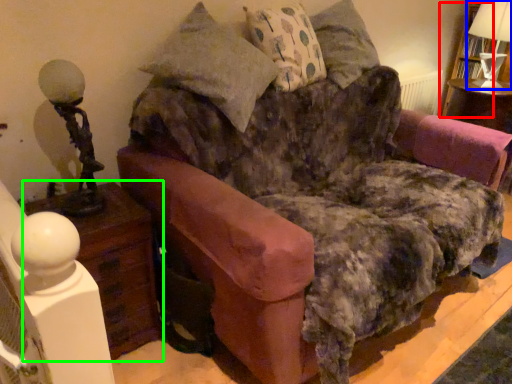
Question: Estimate the real-world distances between objects in this image. Which object is closer to bookshelf (highlighted by a red box), table lamp (highlighted by a blue box) or nightstand (highlighted by a green box)?

Choices:
 (A) table lamp
 (B) nightstand

Answer: (A)